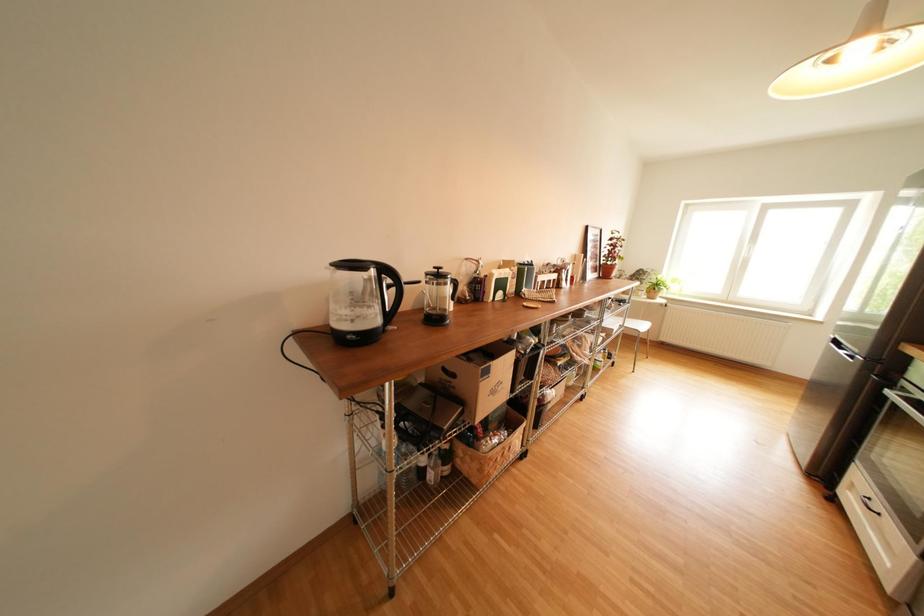
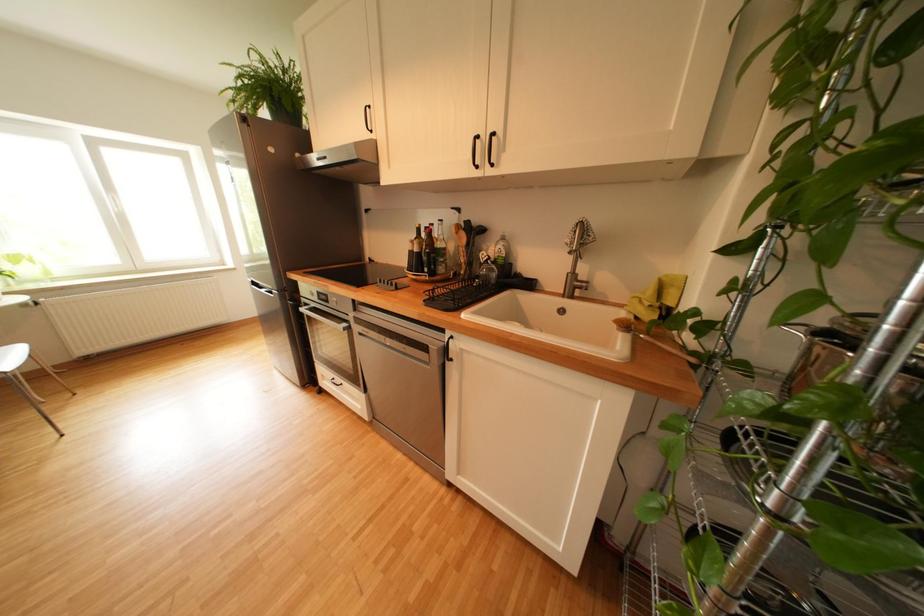
First-person continuous shooting, in which direction is the camera rotating?

The rotation direction of the camera is right-down.